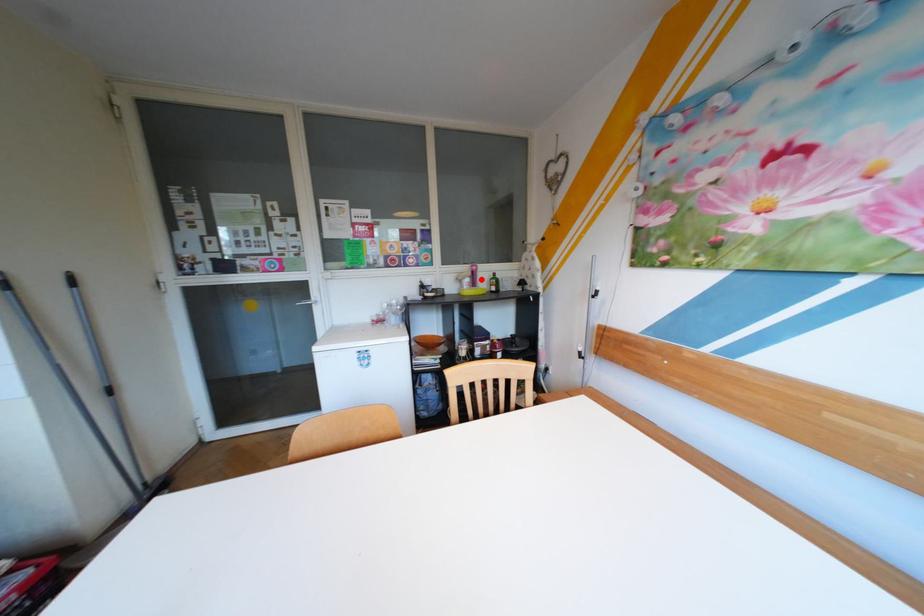
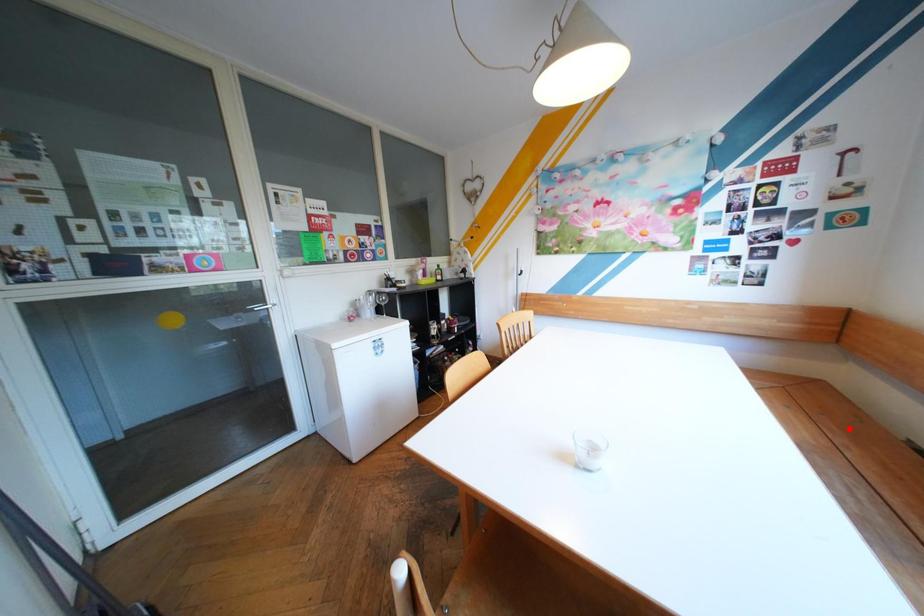
I am providing you with two images of the same scene from different viewpoints. A red point is marked on the first image and another point is marked on the second image. Does the point marked in image1 correspond to the same location as the one in image2?

No